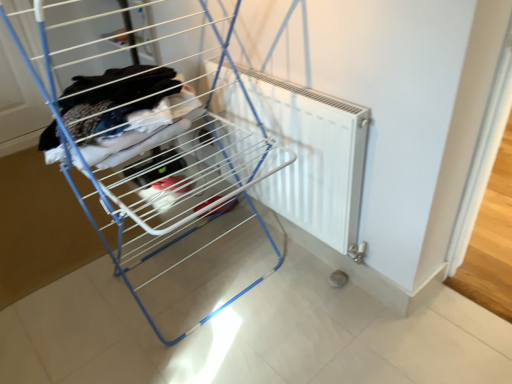
I want to click on white matte radiator at center, so (313, 157).

What is the approximate height of white matte radiator at center?

27.70 inches.

This screenshot has height=384, width=512. What do you see at coordinates (313, 157) in the screenshot?
I see `white matte radiator at center` at bounding box center [313, 157].

Find the location of a particular element. This screenshot has width=512, height=384. white plastic radiator at center is located at coordinates (158, 144).

The image size is (512, 384). Describe the element at coordinates (158, 144) in the screenshot. I see `white plastic radiator at center` at that location.

Where is `white matte radiator at center`? The height and width of the screenshot is (384, 512). white matte radiator at center is located at coordinates (313, 157).

Which is more to the right, white plastic radiator at center or white matte radiator at center?

white matte radiator at center.

Which object is closer to the camera, white plastic radiator at center or white matte radiator at center?

Positioned in front is white plastic radiator at center.

Considering the positions of points (207, 221) and (335, 174), is point (207, 221) farther from camera compared to point (335, 174)?

Yes, point (207, 221) is behind point (335, 174).

From the image's perspective, which is below, white plastic radiator at center or white matte radiator at center?

white matte radiator at center appears lower in the image.

From a real-world perspective, is white plastic radiator at center positioned above or below white matte radiator at center?

white plastic radiator at center is above white matte radiator at center.

Considering the relative sizes of white plastic radiator at center and white matte radiator at center in the image provided, is white plastic radiator at center thinner than white matte radiator at center?

In fact, white plastic radiator at center might be wider than white matte radiator at center.

Is white plastic radiator at center taller than white matte radiator at center?

Yes, white plastic radiator at center is taller than white matte radiator at center.

Looking at the image, does white plastic radiator at center seem bigger or smaller compared to white matte radiator at center?

Clearly, white plastic radiator at center is larger in size than white matte radiator at center.

Is white plastic radiator at center spatially inside white matte radiator at center, or outside of it?

white plastic radiator at center exists outside the volume of white matte radiator at center.

Is white plastic radiator at center directly adjacent to white matte radiator at center?

white plastic radiator at center and white matte radiator at center are clearly separated.

Could you tell me if white plastic radiator at center is turned towards white matte radiator at center?

Yes, white plastic radiator at center is aimed at white matte radiator at center.

How different are the orientations of white plastic radiator at center and white matte radiator at center in degrees?

white plastic radiator at center and white matte radiator at center are facing 1.54 degrees away from each other.

Based on the photo, how far apart are white plastic radiator at center and white matte radiator at center?

white plastic radiator at center and white matte radiator at center are 29.69 centimeters apart from each other.

Identify the location of furniture above the white matte radiator at center (from a real-world perspective). (158, 144).

Does white matte radiator at center appear on the left side of white plastic radiator at center?

Incorrect, white matte radiator at center is not on the left side of white plastic radiator at center.

Considering their positions, is white matte radiator at center located in front of or behind white plastic radiator at center?

white matte radiator at center is behind white plastic radiator at center.

Considering the points (319, 222) and (202, 188), which point is behind, point (319, 222) or point (202, 188)?

The point (202, 188) is behind.

From the picture: From the image's perspective, does white matte radiator at center appear higher than white plastic radiator at center?

→ No, from the image's perspective, white matte radiator at center is not over white plastic radiator at center.

From a real-world perspective, which object stands above the other?

white plastic radiator at center.

Considering the sizes of objects white matte radiator at center and white plastic radiator at center in the image provided, who is thinner, white matte radiator at center or white plastic radiator at center?

With smaller width is white matte radiator at center.

Is white matte radiator at center taller than white plastic radiator at center?

No.

Does white matte radiator at center have a larger size compared to white plastic radiator at center?

No.

Which is correct: white matte radiator at center is inside white plastic radiator at center, or outside of it?

white matte radiator at center is not enclosed by white plastic radiator at center.

Are white matte radiator at center and white plastic radiator at center making contact?

white matte radiator at center and white plastic radiator at center are not in contact.

Could you tell me if white matte radiator at center is facing white plastic radiator at center?

Yes, white matte radiator at center faces towards white plastic radiator at center.

Locate an element on the screen. The image size is (512, 384). radiator behind the white plastic radiator at center is located at coordinates (313, 157).

The image size is (512, 384). I want to click on furniture in front of the white matte radiator at center, so click(158, 144).

Identify the location of radiator on the right of white plastic radiator at center. pyautogui.click(x=313, y=157).